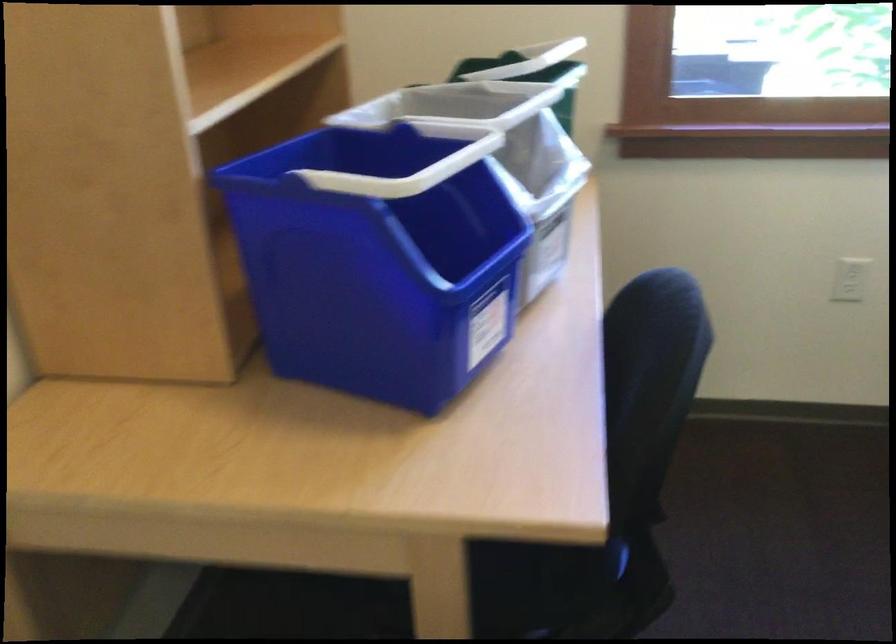
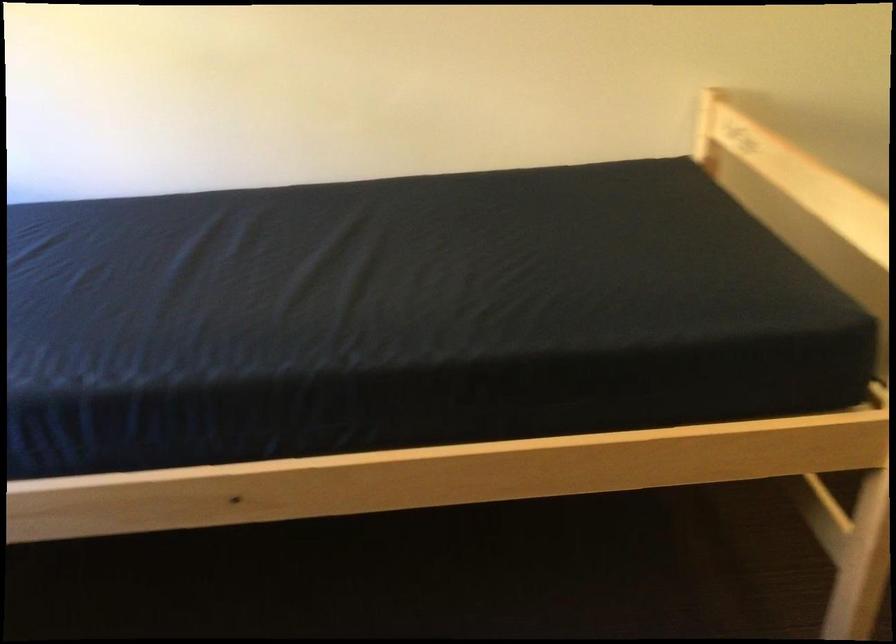
Based on the continuous images, in which direction is the camera rotating?

The rotation direction of the camera is right-down.